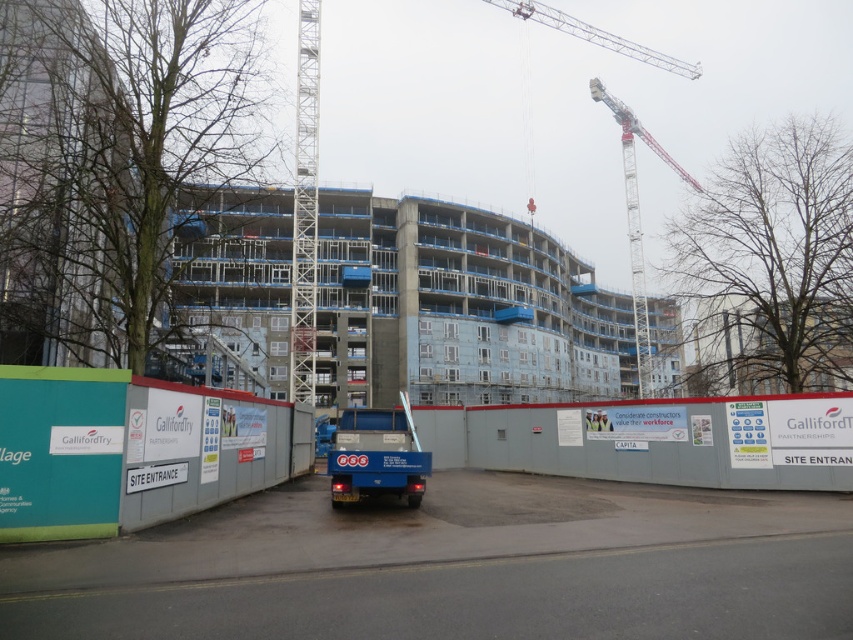
Does concrete wall at center have a larger size compared to concrete building at center?

No.

Who is more forward, (115,547) or (663,300)?

Point (115,547) is in front.

Is point (131, 464) positioned before point (630, 333)?

Yes, point (131, 464) is closer to viewer.

Find the location of `concrete wall at center`. concrete wall at center is located at coordinates (454, 563).

Does white metal crane at upper right have a lesser width compared to metallic silver crane at upper center?

Correct, white metal crane at upper right's width is less than metallic silver crane at upper center's.

Is white metal crane at upper right taller than metallic silver crane at upper center?

Yes.

What do you see at coordinates (636, 225) in the screenshot?
I see `white metal crane at upper right` at bounding box center [636, 225].

At what (x,y) coordinates should I click in order to perform the action: click on white metal crane at upper right. Please return your answer as a coordinate pair (x, y). This screenshot has width=853, height=640. Looking at the image, I should click on (636, 225).

Which is more to the right, concrete wall at center or metallic silver crane at upper center?

Positioned to the right is metallic silver crane at upper center.

Is point (831, 618) positioned after point (579, 35)?

No, (831, 618) is in front of (579, 35).

Identify the location of concrete wall at center. Image resolution: width=853 pixels, height=640 pixels. (454, 563).